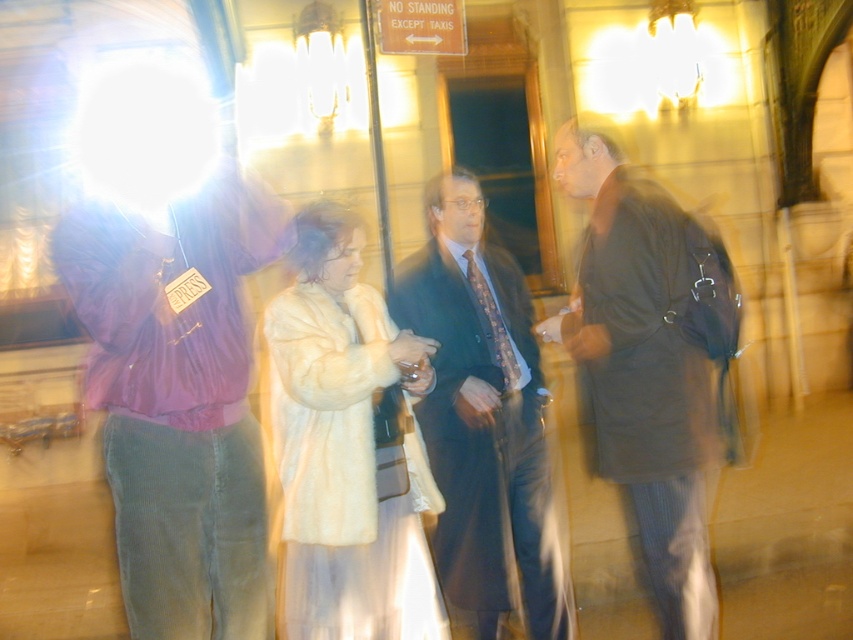
You are standing outside the building and want to take a photo of the fuzzy white fur coat at center and the dark suit at center. Which one should you focus on to ensure it appears clearer in the photo?

You should focus on the fuzzy white fur coat at center because it is closer to the viewer than the dark suit at center, so focusing on it will make that object clearer while the other may appear slightly blurred.

You are a photographer trying to capture a clear shot of the dark brown leather coat at center and the fuzzy white fur coat at center. Based on their positions, which coat is closer to the left side of the image?

The fuzzy white fur coat at center is closer to the left side of the image because the dark brown leather coat at center is positioned to its right.